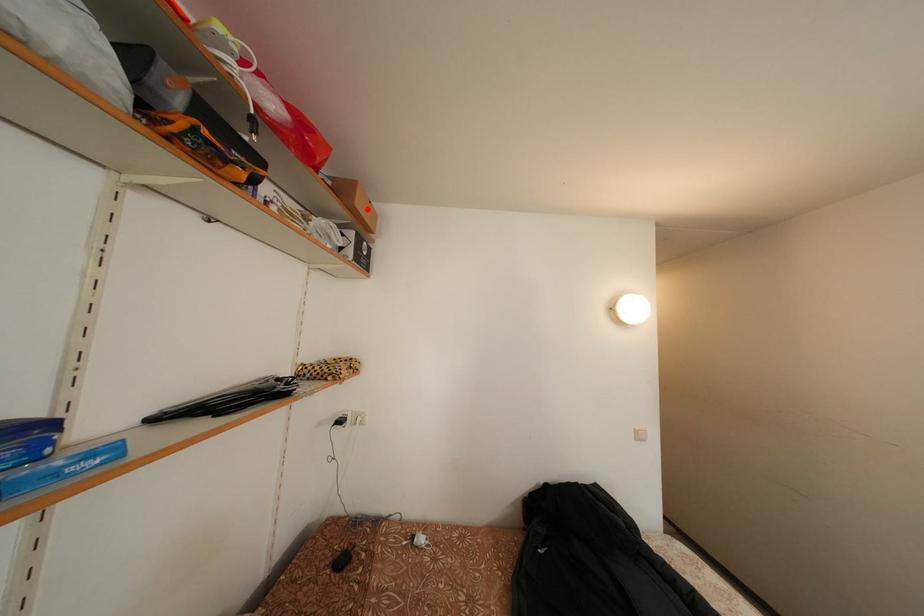
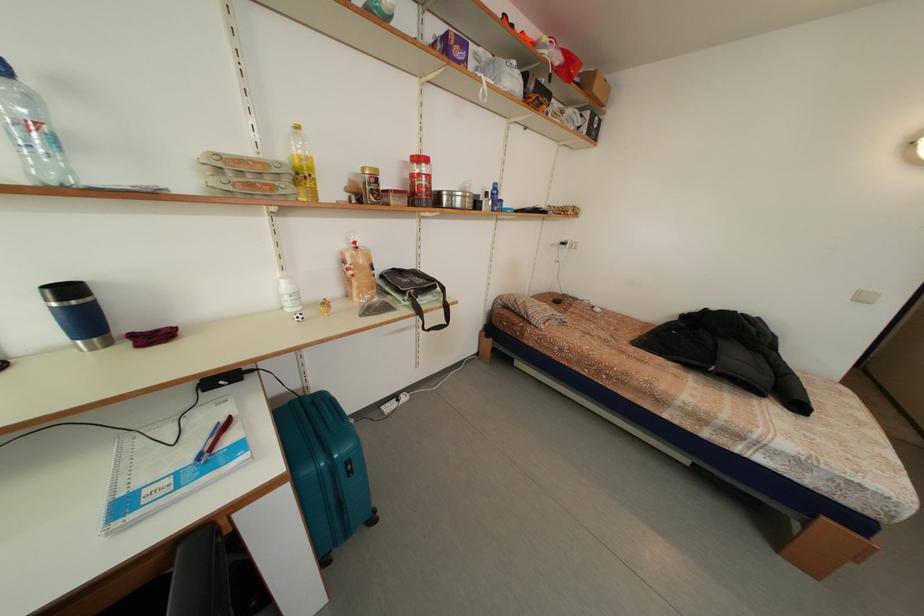
The point at the highlighted location is marked in the first image. Where is the corresponding point in the second image?

(603, 95)